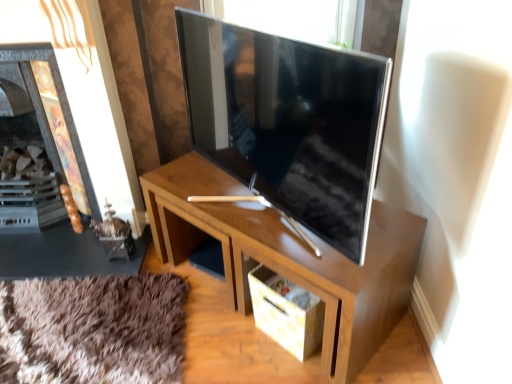
This screenshot has height=384, width=512. I want to click on free space underneath satin silver tv at center (from a real-world perspective), so click(243, 212).